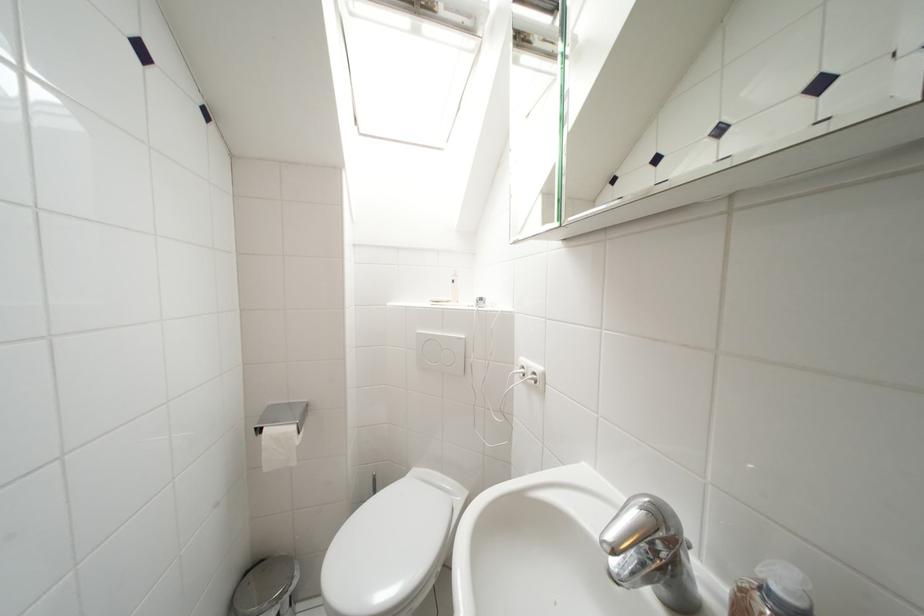
What are the coordinates of `white toilet lid` in the screenshot? It's located at (392, 546).